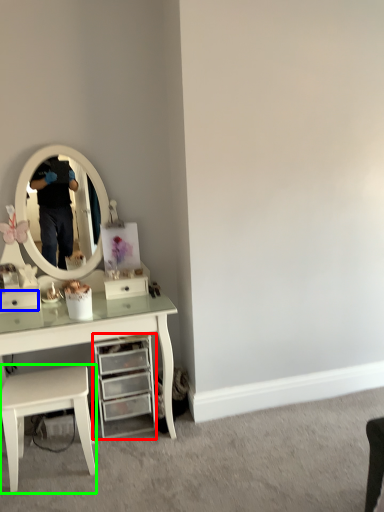
Question: Estimate the real-world distances between objects in this image. Which object is closer to chest of drawers (highlighted by a red box), drawer (highlighted by a blue box) or stool (highlighted by a green box)?

Choices:
 (A) drawer
 (B) stool

Answer: (B)